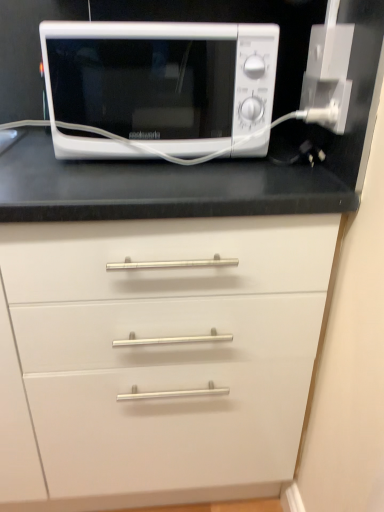
You are a GUI agent. You are given a task and a screenshot of the screen. Output one action in this format:
    pyautogui.click(x=<x>, y=<y>)
    Task: Click on the vacant space in front of white matte microwave at upper center
    
    Given the screenshot: What is the action you would take?
    pyautogui.click(x=145, y=184)